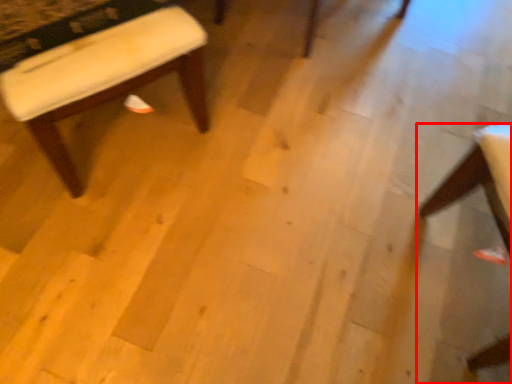
Question: Observing the image, what is the correct spatial positioning of chair (annotated by the red box) in reference to stool?

Choices:
 (A) left
 (B) right

Answer: (B)